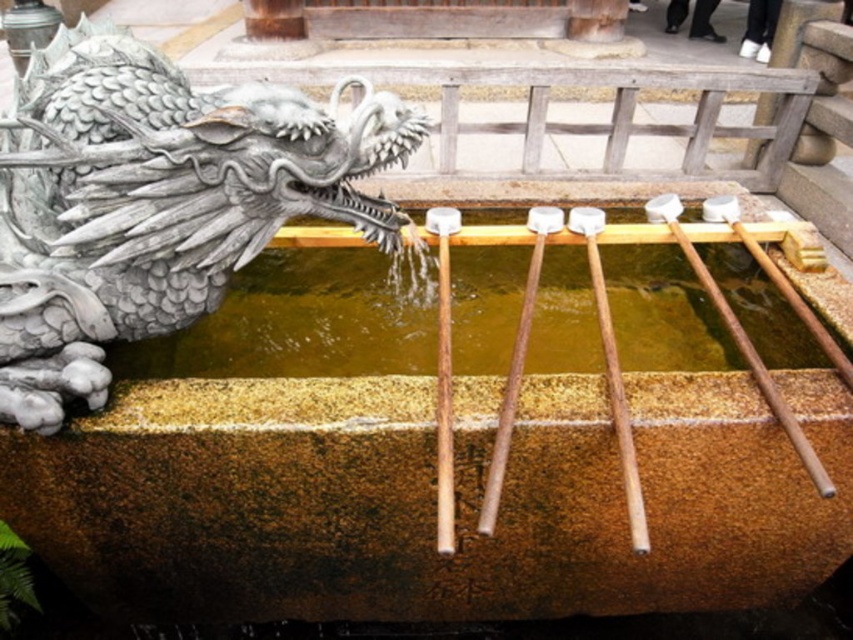
Looking at this image, you are standing in front of the traditional Japanese water purification fountain. You want to touch both the gray stone dragon head at left and the yellowish stone water at center. Which object will require you to reach further to touch it?

The yellowish stone water at center is further away from you than the gray stone dragon head at left, so you will need to reach further to touch the yellowish stone water at center.